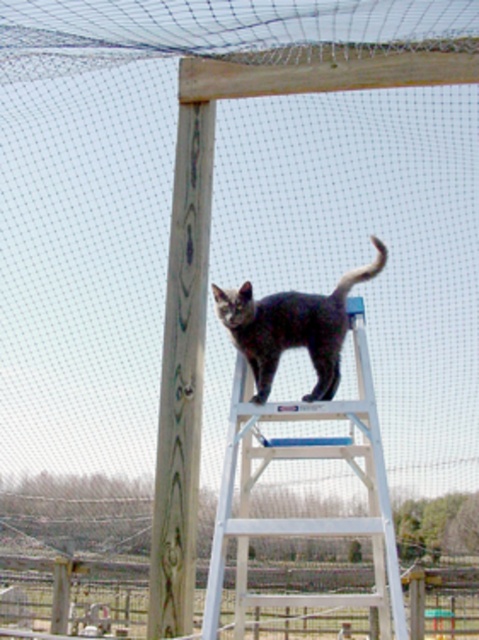
You are a visitor in the enclosure and want to take a photo of the gray fur cat at center without the wooden pole at center blocking the view. Is the cat currently positioned in a way that allows this?

The gray fur cat at center is behind the wooden pole at center, so it is blocked by the pole. To take a photo without the pole blocking the view, you would need to move to a position where the cat is no longer behind the pole.

You are standing in the enclosure and want to determine which of the two points, point (174, 204) or point (338, 376), is closer to you. Based on the scene, which point is nearer?

Point (174, 204) is closer to you because it is further to the viewer than point (338, 376).